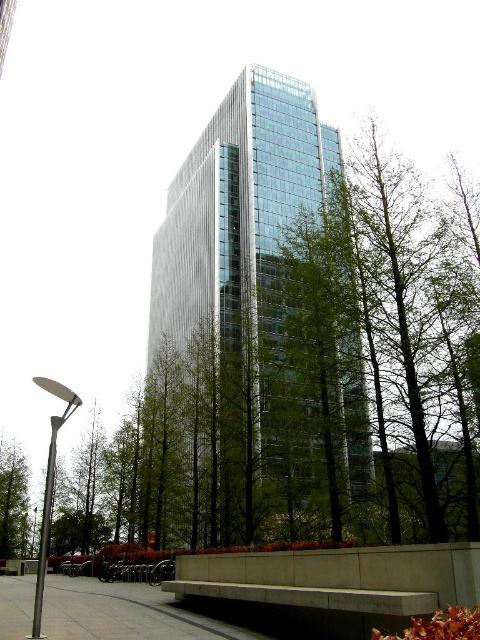
Question: Considering the real-world distances, which object is closest to the glassy metallic skyscraper at center?

Choices:
 (A) green leafy tree at center
 (B) concrete pavement at lower center

Answer: (A)

Question: In this image, where is concrete pavement at lower center located relative to green leafy tree at center?

Choices:
 (A) left
 (B) right

Answer: (B)

Question: Is glassy metallic skyscraper at center smaller than concrete pavement at lower center?

Choices:
 (A) no
 (B) yes

Answer: (A)

Question: Does glassy metallic skyscraper at center lie behind green leafy tree at center?

Choices:
 (A) no
 (B) yes

Answer: (A)

Question: Which object is the closest to the green leafy tree at center?

Choices:
 (A) concrete pavement at lower center
 (B) glassy metallic skyscraper at center

Answer: (B)

Question: Which point is farther to the camera?

Choices:
 (A) (122, 630)
 (B) (292, 150)

Answer: (B)